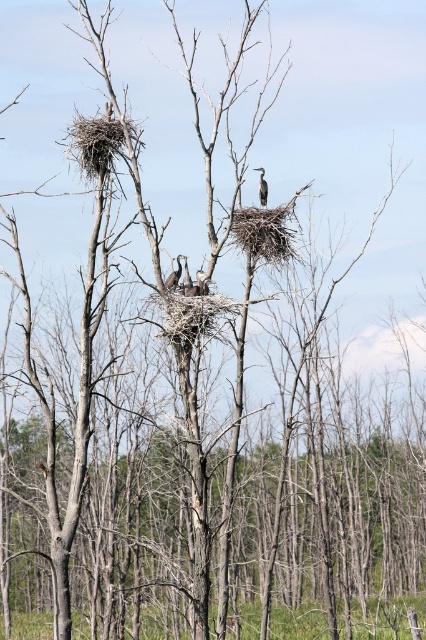
Does brown textured bird at center appear on the right side of brown textured nest at center?

Correct, you'll find brown textured bird at center to the right of brown textured nest at center.

Who is taller, brown textured bird at center or brown textured nest at center?

brown textured nest at center is taller.

Identify the location of brown textured bird at center. (198, 285).

Which of these two, dark brown feathers at center or gray feathered heron at center, stands shorter?

dark brown feathers at center is shorter.

Identify the location of dark brown feathers at center. (173, 276).

Consider the image. Can you confirm if dark brown feathers at center is taller than brown textured nest at center?

In fact, dark brown feathers at center may be shorter than brown textured nest at center.

How far apart are dark brown feathers at center and brown textured nest at center?

dark brown feathers at center and brown textured nest at center are 6.70 inches apart.

Where is `dark brown feathers at center`? This screenshot has height=640, width=426. dark brown feathers at center is located at coordinates (173, 276).